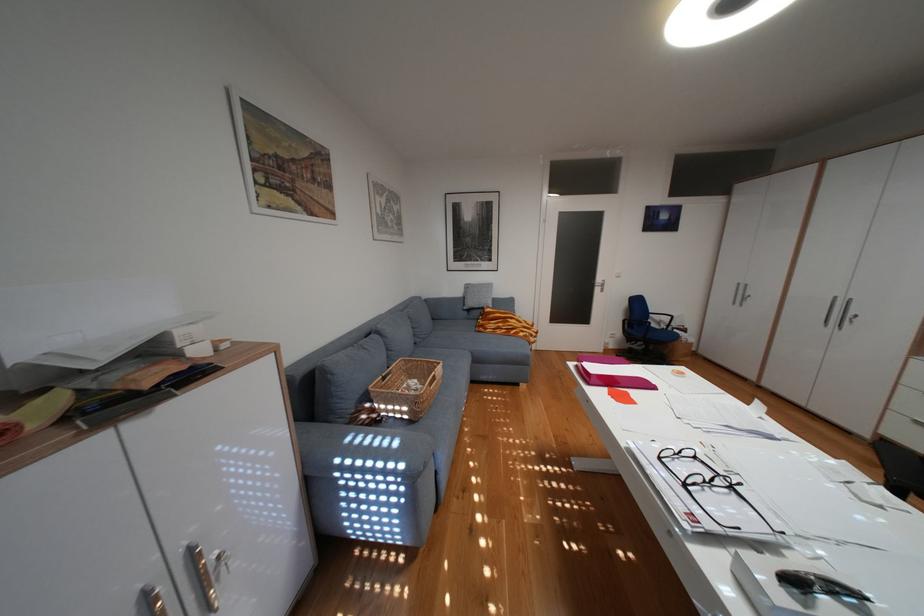
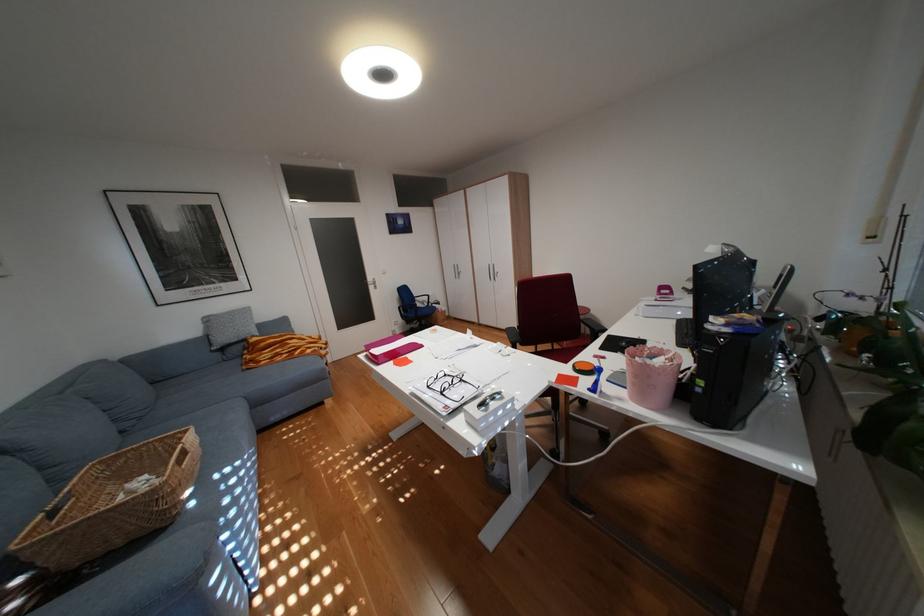
Locate, in the second image, the point that corresponds to (x=857, y=468) in the first image.

(512, 345)